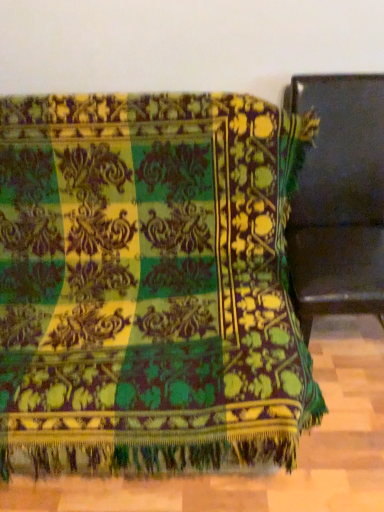
Question: Is point (304, 268) positioned closer to the camera than point (150, 208)?

Choices:
 (A) farther
 (B) closer

Answer: (B)

Question: Considering the positions of matte black chair at right, the 1th furniture positioned from the right, and velvet green blanket at center, the second furniture positioned from the right, in the image, is matte black chair at right, the 1th furniture positioned from the right, taller or shorter than velvet green blanket at center, the second furniture positioned from the right,?

Choices:
 (A) short
 (B) tall

Answer: (B)

Question: Is matte black chair at right, which is counted as the 2th furniture, starting from the left, bigger or smaller than velvet green blanket at center, the second furniture positioned from the right?

Choices:
 (A) small
 (B) big

Answer: (A)

Question: Considering the positions of point (311, 126) and point (367, 138), is point (311, 126) closer or farther from the camera than point (367, 138)?

Choices:
 (A) farther
 (B) closer

Answer: (B)

Question: From a real-world perspective, is velvet green blanket at center, the second furniture positioned from the right, physically located above or below matte black chair at right, the 1th furniture positioned from the right?

Choices:
 (A) below
 (B) above

Answer: (A)

Question: Is velvet green blanket at center, the first furniture when ordered from left to right, wider or thinner than matte black chair at right, the 1th furniture positioned from the right?

Choices:
 (A) wide
 (B) thin

Answer: (A)

Question: Considering the positions of velvet green blanket at center, the second furniture positioned from the right, and matte black chair at right, which is counted as the 2th furniture, starting from the left, in the image, is velvet green blanket at center, the second furniture positioned from the right, bigger or smaller than matte black chair at right, which is counted as the 2th furniture, starting from the left,?

Choices:
 (A) small
 (B) big

Answer: (B)